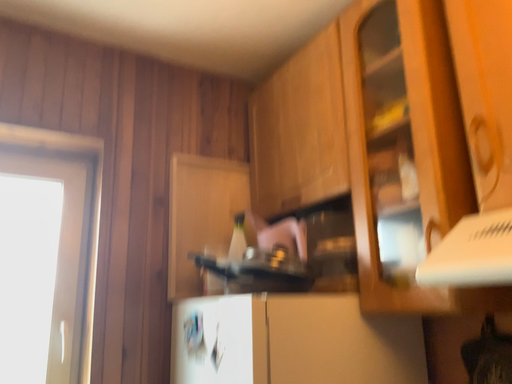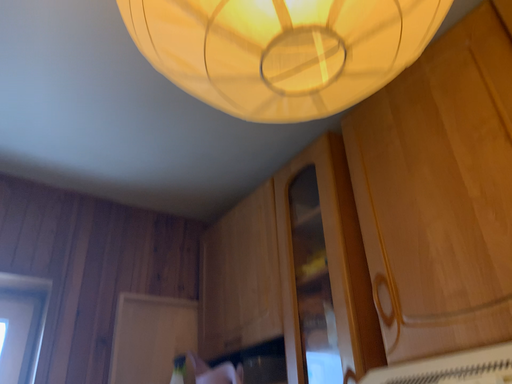
Question: How did the camera likely rotate when shooting the video?

Choices:
 (A) rotated downward
 (B) rotated upward

Answer: (B)